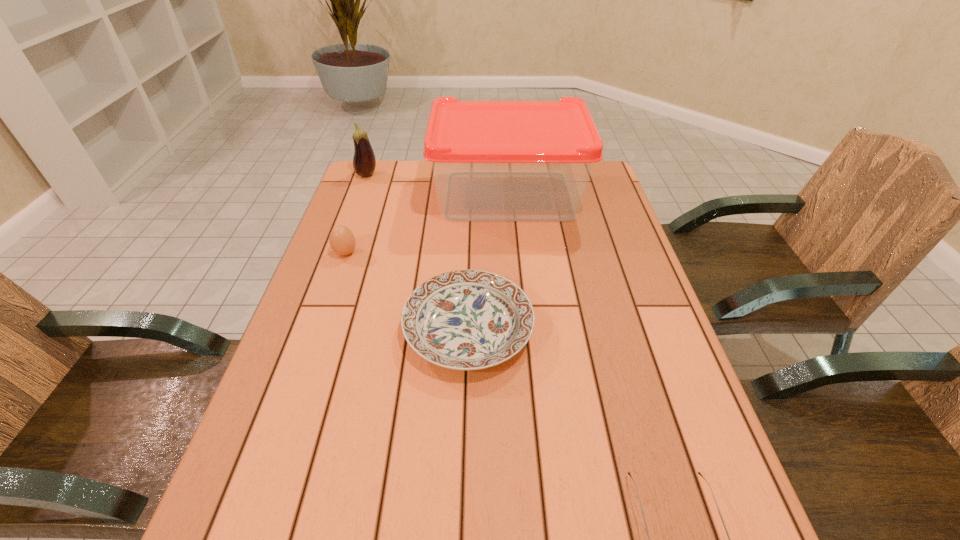
The width and height of the screenshot is (960, 540). In order to click on empty space between the third nearest object and the tallest object in this screenshot , I will do `click(426, 224)`.

Locate an element on the screen. The image size is (960, 540). vacant space in between the third shortest object and the fourth shortest object is located at coordinates (356, 214).

The image size is (960, 540). Identify the location of vacant point located between the fourth farthest object and the third tallest object. (407, 291).

Identify which object is the second nearest to the second nearest object. Please provide its 2D coordinates. Your answer should be formatted as a tuple, i.e. [(x, y)], where the tuple contains the x and y coordinates of a point satisfying the conditions above.

[(699, 473)]

Identify which object is the second nearest to the spectacles. Please provide its 2D coordinates. Your answer should be formatted as a tuple, i.e. [(x, y)], where the tuple contains the x and y coordinates of a point satisfying the conditions above.

[(492, 160)]

Find the location of a particular element. free space that satisfies the following two spatial constraints: 1. on the front side of the eggplant; 2. on the left side of the second nearest object is located at coordinates (311, 329).

You are a GUI agent. You are given a task and a screenshot of the screen. Output one action in this format:
    pyautogui.click(x=<x>, y=<y>)
    Task: Click on the free space that satisfies the following two spatial constraints: 1. on the front side of the tallest object; 2. on the left side of the eggplant
    Image resolution: width=960 pixels, height=540 pixels.
    Given the screenshot: What is the action you would take?
    pyautogui.click(x=359, y=195)

Find the location of a particular element. The width and height of the screenshot is (960, 540). vacant space that satisfies the following two spatial constraints: 1. on the back side of the tray; 2. on the right side of the boiled egg is located at coordinates (366, 195).